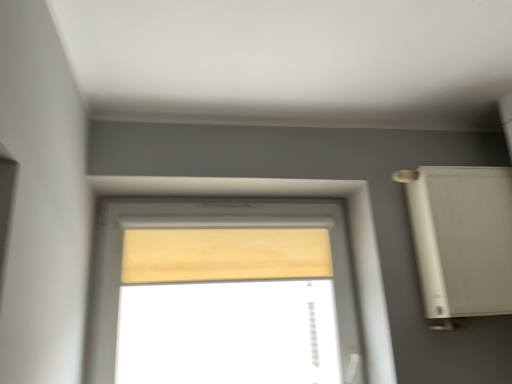
Question: Considering the relative sizes of white plastic air conditioner at right and beige fabric curtain at center in the image provided, is white plastic air conditioner at right shorter than beige fabric curtain at center?

Choices:
 (A) yes
 (B) no

Answer: (B)

Question: Can you see white plastic air conditioner at right touching beige fabric curtain at center?

Choices:
 (A) no
 (B) yes

Answer: (A)

Question: Could you tell me if white plastic air conditioner at right is facing beige fabric curtain at center?

Choices:
 (A) yes
 (B) no

Answer: (B)

Question: From the image's perspective, is white plastic air conditioner at right located above beige fabric curtain at center?

Choices:
 (A) no
 (B) yes

Answer: (B)

Question: From the image's perspective, is white plastic air conditioner at right beneath beige fabric curtain at center?

Choices:
 (A) yes
 (B) no

Answer: (B)

Question: Looking at their shapes, would you say white plastic air conditioner at right is wider or thinner than beige fabric curtain at center?

Choices:
 (A) thin
 (B) wide

Answer: (B)

Question: Looking at the image, does white plastic air conditioner at right seem bigger or smaller compared to beige fabric curtain at center?

Choices:
 (A) big
 (B) small

Answer: (A)

Question: Considering the relative positions of white plastic air conditioner at right and beige fabric curtain at center in the image provided, is white plastic air conditioner at right to the left or to the right of beige fabric curtain at center?

Choices:
 (A) right
 (B) left

Answer: (A)

Question: From a real-world perspective, relative to beige fabric curtain at center, is white plastic air conditioner at right vertically above or below?

Choices:
 (A) above
 (B) below

Answer: (B)

Question: From a real-world perspective, is beige fabric curtain at center above or below wooden blind at center?

Choices:
 (A) above
 (B) below

Answer: (A)

Question: From their relative heights in the image, would you say beige fabric curtain at center is taller or shorter than wooden blind at center?

Choices:
 (A) short
 (B) tall

Answer: (A)

Question: In terms of size, does beige fabric curtain at center appear bigger or smaller than wooden blind at center?

Choices:
 (A) small
 (B) big

Answer: (A)

Question: Considering the positions of point 134,279 and point 264,377, is point 134,279 closer or farther from the camera than point 264,377?

Choices:
 (A) closer
 (B) farther

Answer: (A)

Question: Looking at their shapes, would you say white plastic air conditioner at right is wider or thinner than wooden blind at center?

Choices:
 (A) wide
 (B) thin

Answer: (A)

Question: Considering the positions of white plastic air conditioner at right and wooden blind at center in the image, is white plastic air conditioner at right bigger or smaller than wooden blind at center?

Choices:
 (A) small
 (B) big

Answer: (B)